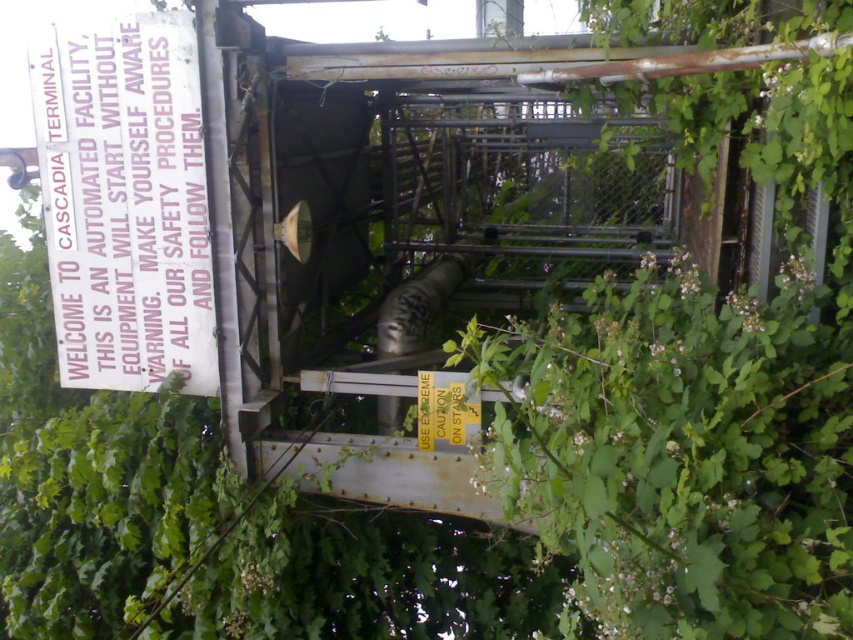
You are a new employee at the Cascadia Terminal. You see the white paper sign at left and the yellow paper at center. Which one is nearer to you?

The white paper sign at left is closer to the viewer than the yellow paper at center.

You are a safety inspector at the Cascadia Terminal. You need to locate the point at coordinates (125,200). Where would you find it?

The point at coordinates (125,200) is located on the white paper sign at left.